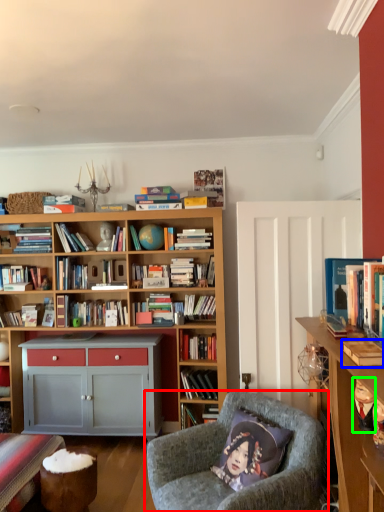
Question: Based on their relative distances, which object is farther from chair (highlighted by a red box)? Choose from book (highlighted by a blue box) and toy (highlighted by a green box).

Choices:
 (A) book
 (B) toy

Answer: (A)